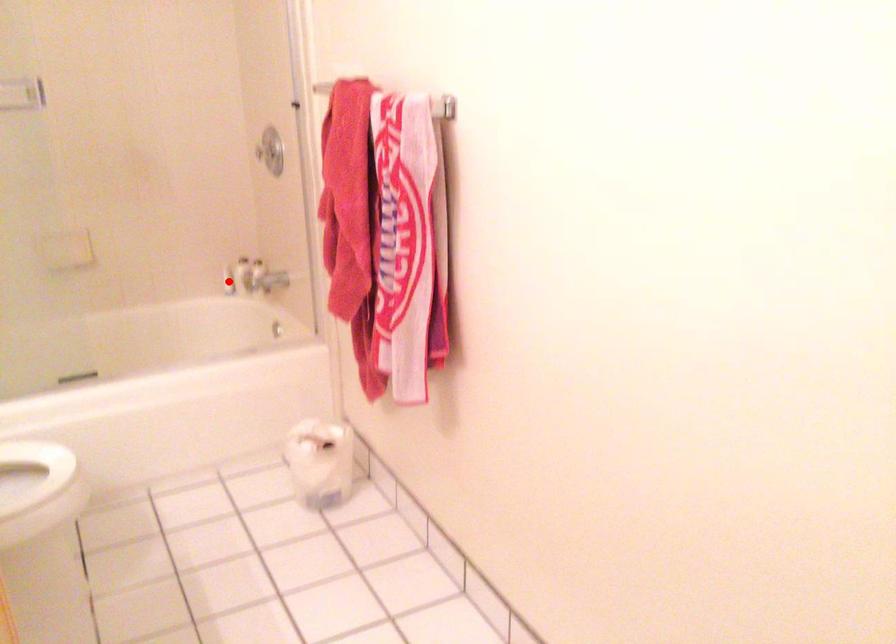
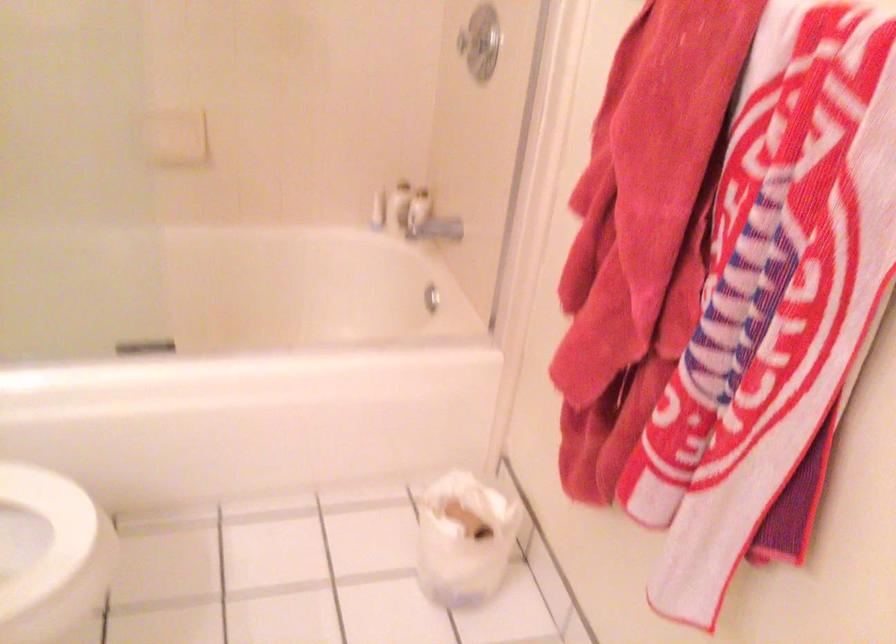
In the second image, find the point that corresponds to the highlighted location in the first image.

(378, 211)